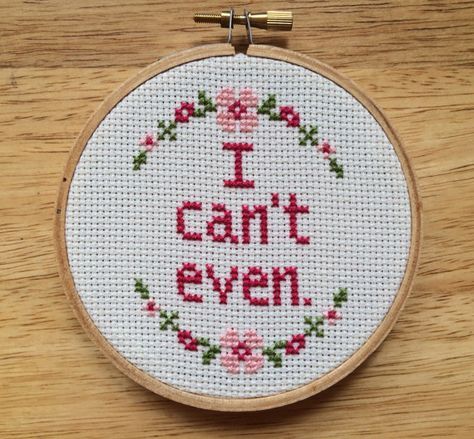
At what (x,y) coordinates should I click in order to perform the action: click on parts of embroidery hoop. Please return your answer as a coordinate pair (x, y). Looking at the image, I should click on (223, 19), (227, 31), (248, 28), (277, 15), (208, 47).